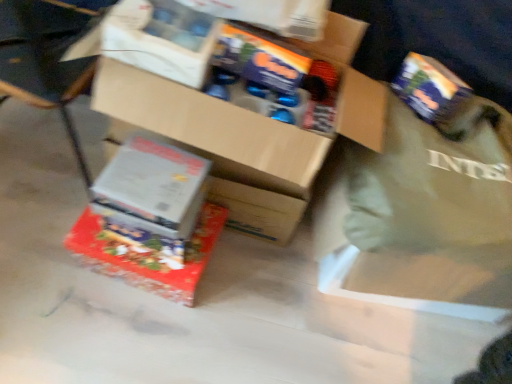
At what (x,y) coordinates should I click in order to perform the action: click on unoccupied region to the right of shiny metallic box at center, placed as the 3th box when sorted from top to bottom. Please return your answer as a coordinate pair (x, y). Looking at the image, I should click on (245, 293).